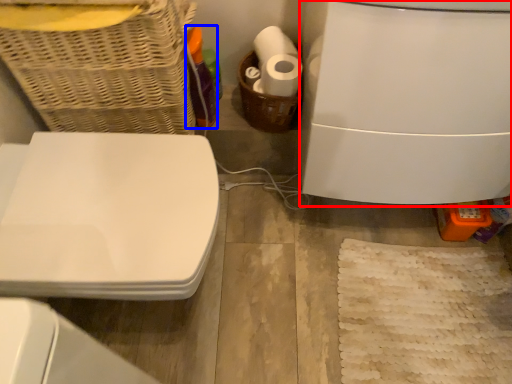
Question: Which object is further to the camera taking this photo, appliance (highlighted by a red box) or bottle (highlighted by a blue box)?

Choices:
 (A) appliance
 (B) bottle

Answer: (B)